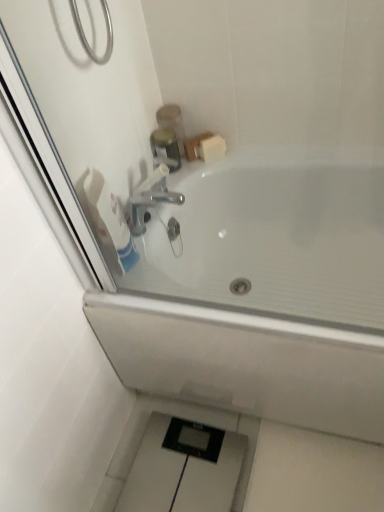
Question: Considering their positions, is brushed metal soap dispenser at upper center located in front of or behind white matte soap at upper right?

Choices:
 (A) behind
 (B) front

Answer: (B)

Question: From the image's perspective, is brushed metal soap dispenser at upper center positioned above or below white matte soap at upper right?

Choices:
 (A) above
 (B) below

Answer: (A)

Question: Based on their relative distances, which object is nearer to the white matte toilet paper at upper left?

Choices:
 (A) brushed metal faucet at upper center
 (B) brushed metal soap dispenser at upper center
 (C) white glossy bathtub at upper center
 (D) white matte soap at upper right

Answer: (A)

Question: Based on their relative distances, which object is nearer to the white matte toilet paper at upper left?

Choices:
 (A) brushed metal faucet at upper center
 (B) brushed metal soap dispenser at upper center
 (C) white matte soap at upper right
 (D) white glossy bathtub at upper center

Answer: (A)